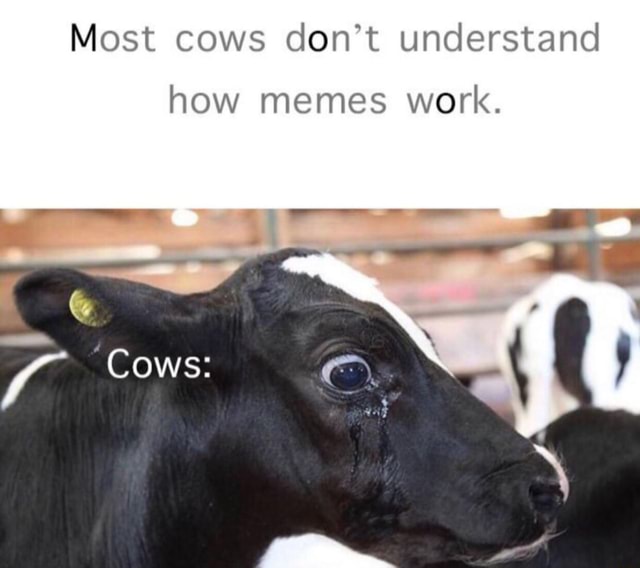
Find the location of a particular element. lights is located at coordinates (612, 232), (528, 207), (182, 217).